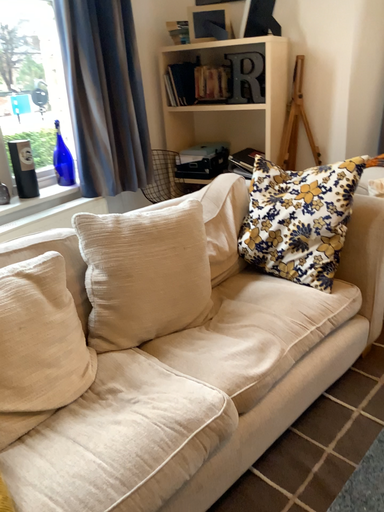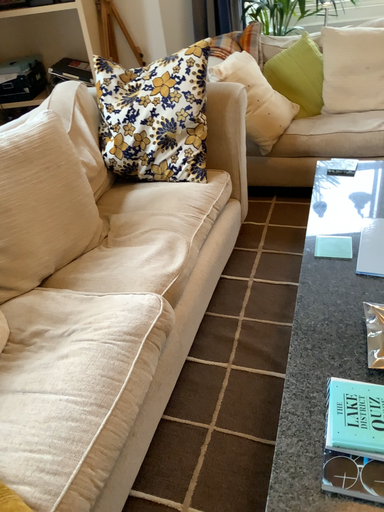
Question: Which way did the camera rotate in the video?

Choices:
 (A) rotated upward
 (B) rotated downward

Answer: (B)